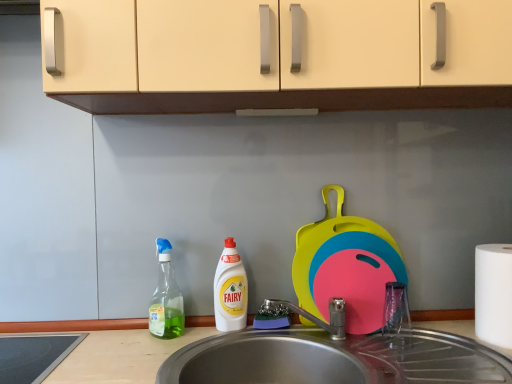
Question: Is white matte paper towel at right at the back of metallic stainless steel sink at lower center?

Choices:
 (A) yes
 (B) no

Answer: (B)

Question: From a real-world perspective, is metallic stainless steel sink at lower center on white matte paper towel at right?

Choices:
 (A) no
 (B) yes

Answer: (A)

Question: From a real-world perspective, is metallic stainless steel sink at lower center positioned under white matte paper towel at right based on gravity?

Choices:
 (A) no
 (B) yes

Answer: (B)

Question: Is metallic stainless steel sink at lower center bigger than white matte paper towel at right?

Choices:
 (A) yes
 (B) no

Answer: (A)

Question: Is metallic stainless steel sink at lower center thinner than white matte paper towel at right?

Choices:
 (A) no
 (B) yes

Answer: (A)

Question: Is point (492, 246) positioned closer to the camera than point (144, 380)?

Choices:
 (A) farther
 (B) closer

Answer: (A)

Question: In the image, is white matte paper towel at right on the left side or the right side of metallic stainless steel sink at lower center?

Choices:
 (A) right
 (B) left

Answer: (A)

Question: Based on their sizes in the image, would you say white matte paper towel at right is bigger or smaller than metallic stainless steel sink at lower center?

Choices:
 (A) small
 (B) big

Answer: (A)

Question: Looking at their shapes, would you say white matte paper towel at right is wider or thinner than metallic stainless steel sink at lower center?

Choices:
 (A) thin
 (B) wide

Answer: (A)

Question: Considering the positions of point (227, 324) and point (510, 345), is point (227, 324) closer or farther from the camera than point (510, 345)?

Choices:
 (A) farther
 (B) closer

Answer: (A)

Question: Looking at their shapes, would you say white plastic bottle at center is wider or thinner than white matte paper towel at right?

Choices:
 (A) wide
 (B) thin

Answer: (B)

Question: Based on their sizes in the image, would you say white plastic bottle at center is bigger or smaller than white matte paper towel at right?

Choices:
 (A) big
 (B) small

Answer: (B)

Question: Is white plastic bottle at center taller or shorter than white matte paper towel at right?

Choices:
 (A) short
 (B) tall

Answer: (B)

Question: Is transparent plastic spray bottle at left to the left or to the right of white matte paper towel at right in the image?

Choices:
 (A) left
 (B) right

Answer: (A)

Question: Is transparent plastic spray bottle at left wider or thinner than white matte paper towel at right?

Choices:
 (A) thin
 (B) wide

Answer: (A)